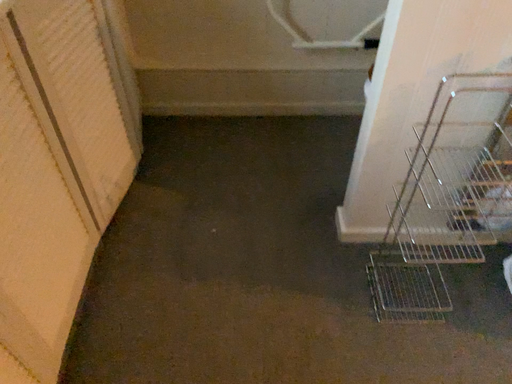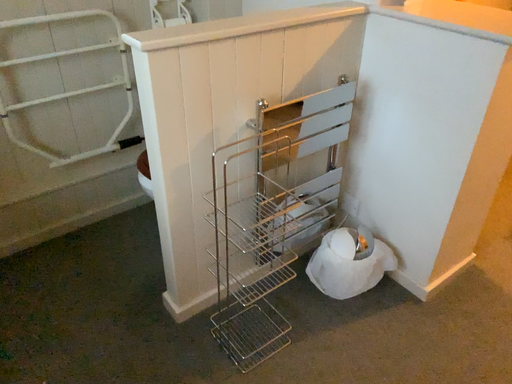
Question: Which way did the camera rotate in the video?

Choices:
 (A) rotated downward
 (B) rotated upward

Answer: (B)